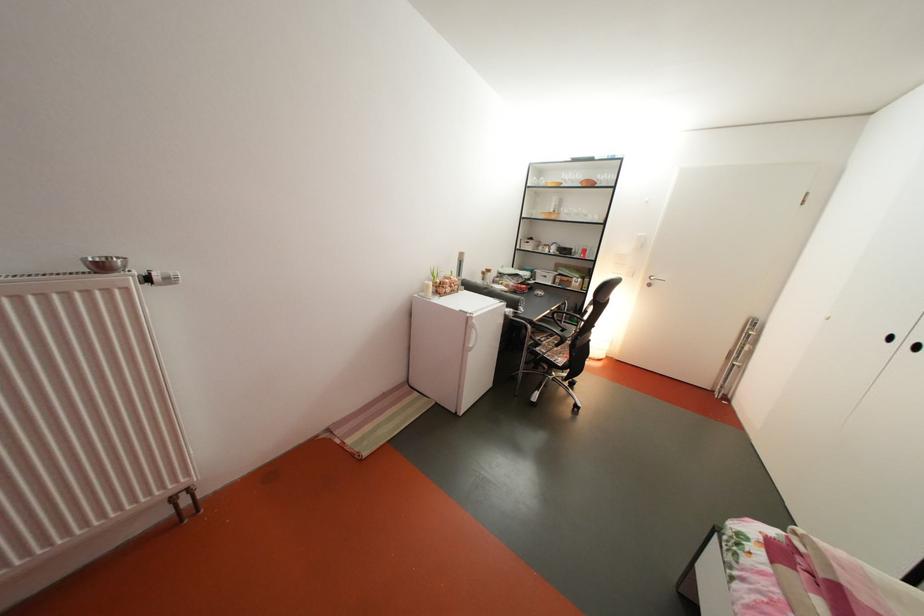
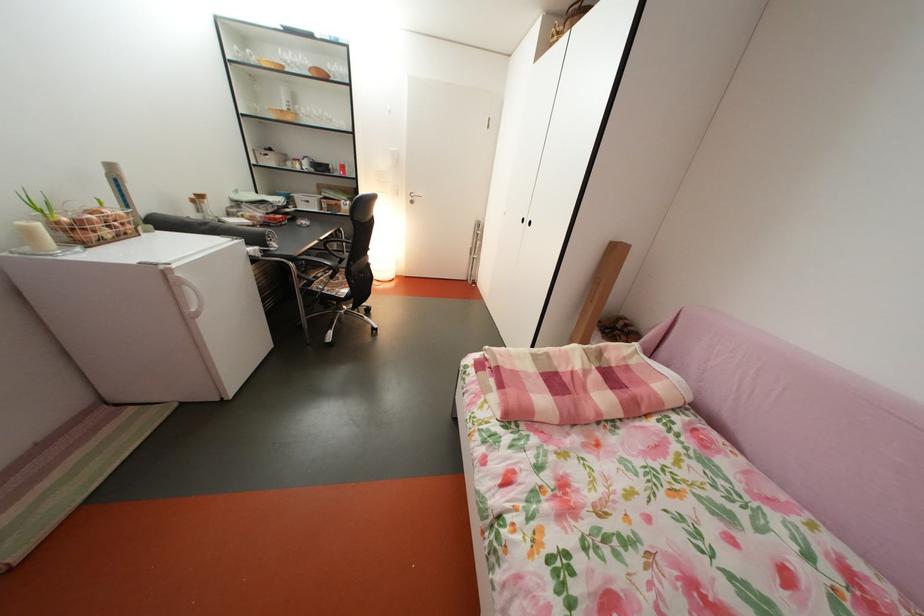
In the second image, find the point that corresponds to pixel 565 224 in the first image.

(300, 124)